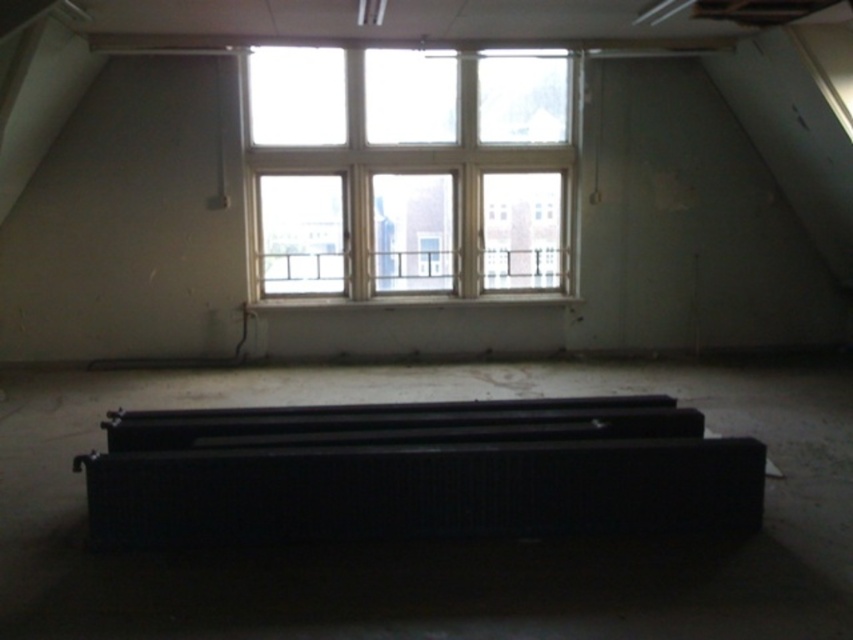
Question: Which of the following is the closest to the observer?

Choices:
 (A) black matte radiator at center
 (B) clear glass window at upper center

Answer: (A)

Question: Does black matte radiator at center lie behind clear glass window at upper center?

Choices:
 (A) no
 (B) yes

Answer: (A)

Question: Is black matte radiator at center in front of clear glass window at upper center?

Choices:
 (A) no
 (B) yes

Answer: (B)

Question: Can you confirm if black matte radiator at center is thinner than clear glass window at upper center?

Choices:
 (A) yes
 (B) no

Answer: (B)

Question: Which of the following is the closest to the observer?

Choices:
 (A) clear glass window at upper center
 (B) black matte radiator at center

Answer: (B)